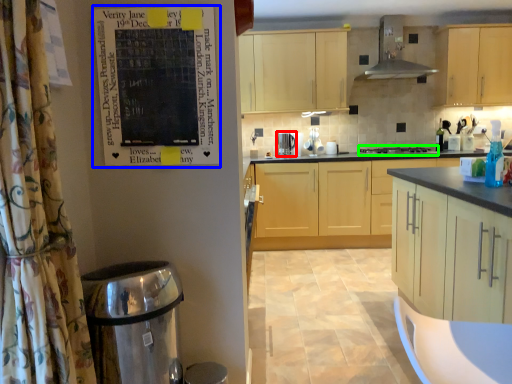
Question: Estimate the real-world distances between objects in this image. Which object is closer to kitchen appliance (highlighted by a red box), bulletin board (highlighted by a blue box) or gas stove (highlighted by a green box)?

Choices:
 (A) bulletin board
 (B) gas stove

Answer: (B)